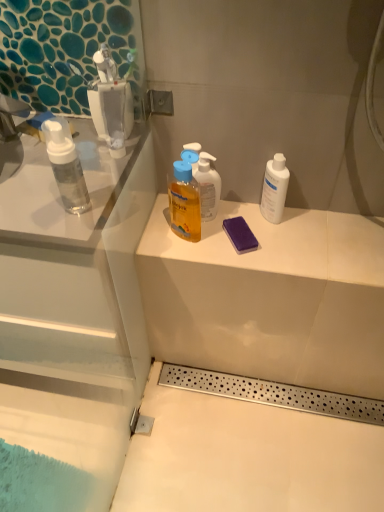
Locate an element on the screen. unoccupied region to the right of white matte bottle at right is located at coordinates (327, 228).